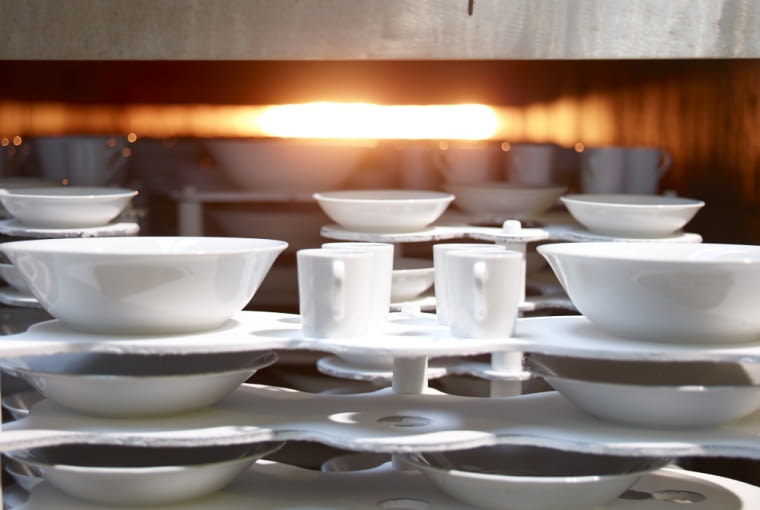
Locate an element on the screen. mugs is located at coordinates (498, 306), (385, 254), (640, 178), (539, 159), (480, 159), (423, 168).